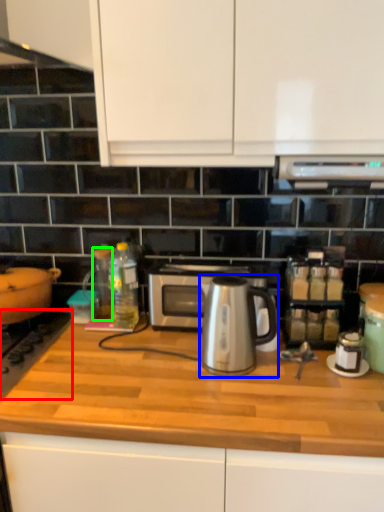
Question: Which object is the closest to the gas stove (highlighted by a red box)? Choose among these: coffeepot (highlighted by a blue box) or bottle (highlighted by a green box).

Choices:
 (A) coffeepot
 (B) bottle

Answer: (B)